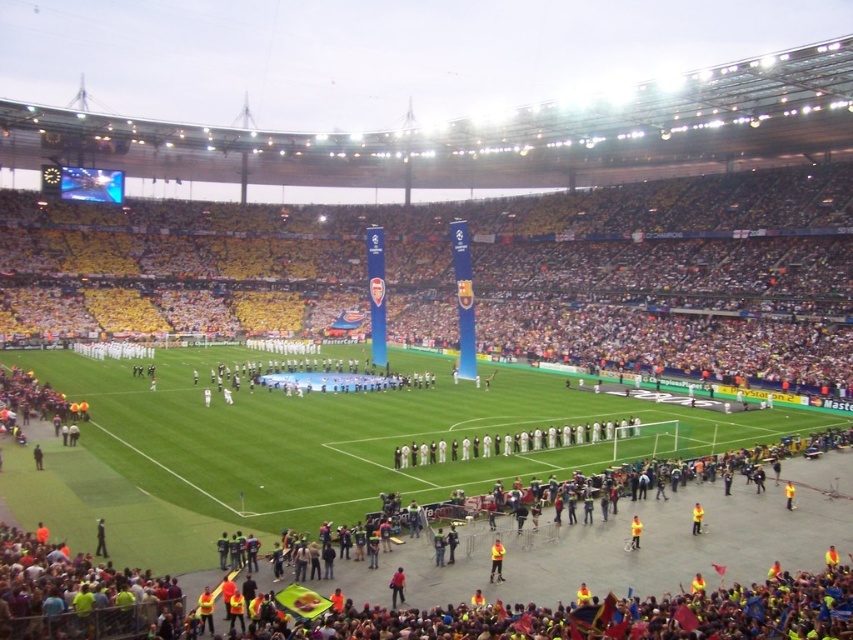
Question: Which of the following is the closest to the observer?

Choices:
 (A) (392, 576)
 (B) (502, 563)
 (C) (701, 509)

Answer: (A)

Question: Estimate the real-world distances between objects in this image. Which object is farther from the red fabric person at lower center?

Choices:
 (A) yellow reflective vest at center
 (B) yellow fabric at lower center

Answer: (A)

Question: Does yellow fabric at lower center come behind red fabric person at lower center?

Choices:
 (A) no
 (B) yes

Answer: (B)

Question: Does red fabric person at lower center have a greater width compared to yellow reflective vest at center?

Choices:
 (A) no
 (B) yes

Answer: (A)

Question: Estimate the real-world distances between objects in this image. Which object is closer to the yellow fabric at lower center?

Choices:
 (A) red fabric person at lower center
 (B) yellow reflective vest at center

Answer: (A)

Question: Where is yellow fabric at lower center located in relation to yellow reflective vest at center in the image?

Choices:
 (A) right
 (B) left

Answer: (B)